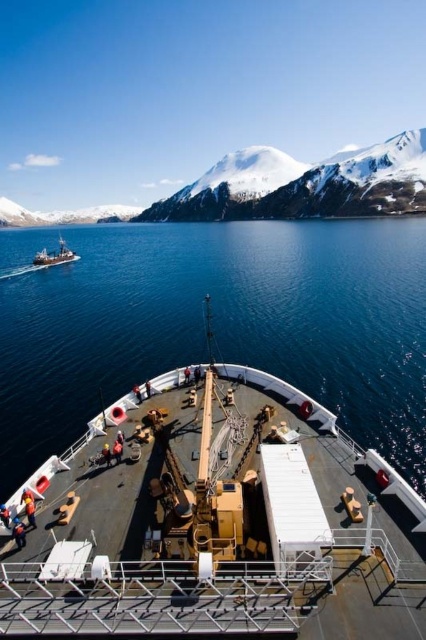
Question: Is snowy white mountain at upper center in front of metallic gray ship at left?

Choices:
 (A) no
 (B) yes

Answer: (A)

Question: Which point is farther from the camera taking this photo?

Choices:
 (A) tap(402, 211)
 (B) tap(71, 250)
 (C) tap(313, 378)

Answer: (A)

Question: Can you confirm if blue water at center is bigger than snowy white mountain at upper center?

Choices:
 (A) no
 (B) yes

Answer: (A)

Question: Based on their relative distances, which object is farther from the metallic gray ship at left?

Choices:
 (A) snowy white mountain at upper center
 (B) blue water at center

Answer: (A)

Question: Can you confirm if blue water at center is wider than snowy white mountain at upper center?

Choices:
 (A) no
 (B) yes

Answer: (A)

Question: Based on their relative distances, which object is nearer to the snowy white mountain at upper center?

Choices:
 (A) blue water at center
 (B) metallic gray ship at left

Answer: (A)